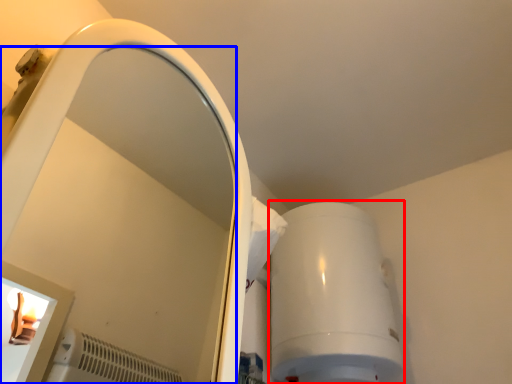
Question: Which object is closer to the camera taking this photo, appliance (highlighted by a red box) or mirror (highlighted by a blue box)?

Choices:
 (A) appliance
 (B) mirror

Answer: (B)